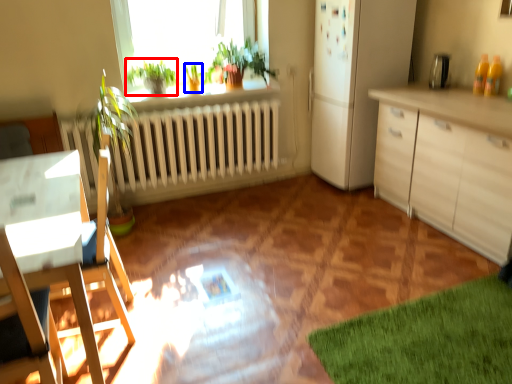
Question: Which object is further to the camera taking this photo, plant (highlighted by a red box) or plant (highlighted by a blue box)?

Choices:
 (A) plant
 (B) plant

Answer: (B)